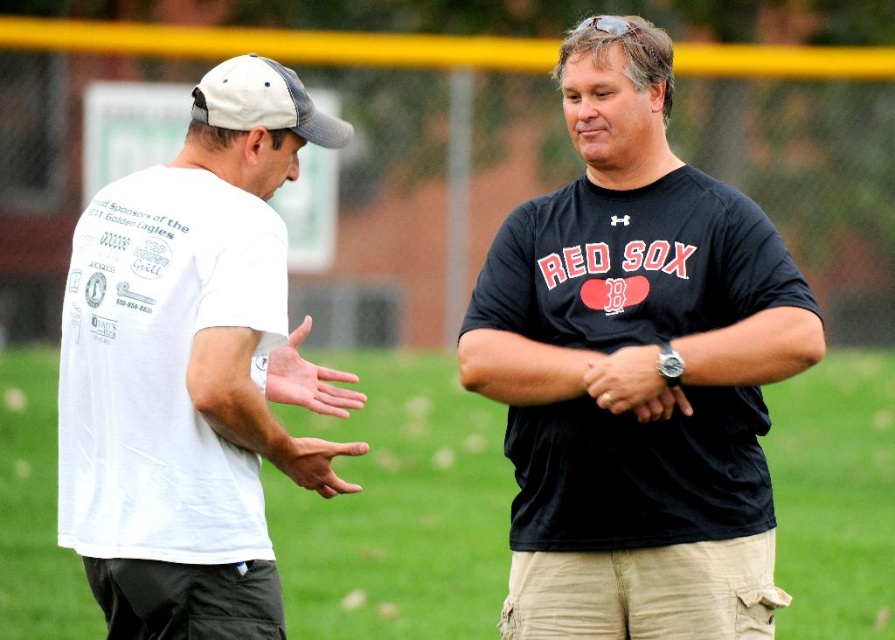
Question: Is black matte t-shirt at center positioned behind white mesh baseball cap at upper left?

Choices:
 (A) no
 (B) yes

Answer: (B)

Question: Considering the real-world distances, which object is closest to the white matte shirt at left?

Choices:
 (A) matte white hand at center
 (B) matte black watch at center
 (C) black matte t-shirt at center

Answer: (A)

Question: Can you confirm if black matte t-shirt at center is positioned below white mesh baseball cap at upper left?

Choices:
 (A) yes
 (B) no

Answer: (A)

Question: Does black matte t-shirt at center appear on the left side of matte black watch at center?

Choices:
 (A) no
 (B) yes

Answer: (B)

Question: Which point appears farthest from the camera in this image?

Choices:
 (A) (94, 465)
 (B) (604, 360)
 (C) (422, 536)
 (D) (276, 104)

Answer: (C)

Question: Which point is closer to the camera?

Choices:
 (A) (312, 387)
 (B) (133, 262)
 (C) (652, 406)
 (D) (593, 627)

Answer: (B)